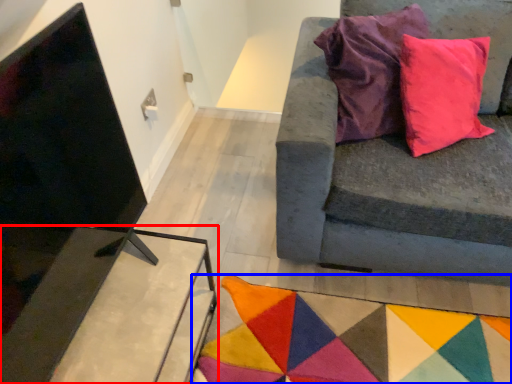
Question: Which point is closer to the camera, table (highlighted by a red box) or mat (highlighted by a blue box)?

Choices:
 (A) table
 (B) mat

Answer: (A)